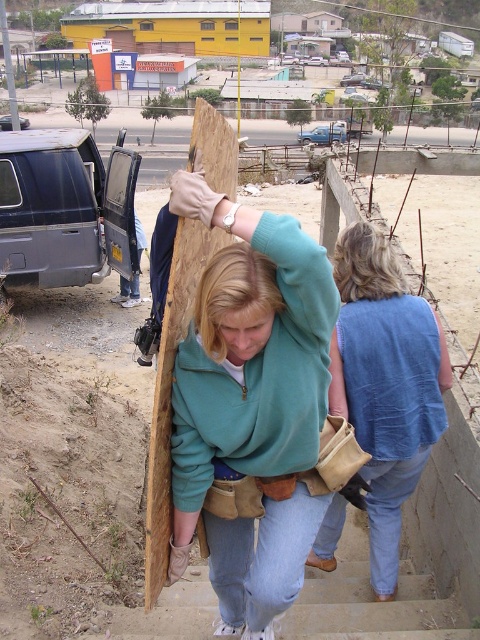
Can you confirm if teal fleece sweatshirt at center is positioned below wooden plank at center?

Yes, teal fleece sweatshirt at center is below wooden plank at center.

Between point (212, 435) and point (204, 115), which one is positioned in front?

Positioned in front is point (212, 435).

The image size is (480, 640). Find the location of `teal fleece sweatshirt at center`. teal fleece sweatshirt at center is located at coordinates (248, 355).

Based on the photo, who is positioned more to the right, blue knitted vest at upper right or wooden plank at center?

blue knitted vest at upper right is more to the right.

Does blue knitted vest at upper right lie in front of wooden plank at center?

No.

Is point (393, 400) in front of point (160, 435)?

That is False.

Find the location of a particular element. blue knitted vest at upper right is located at coordinates (385, 384).

Between teal fleece sweatshirt at center and blue knitted vest at upper right, which one is positioned lower?

teal fleece sweatshirt at center

Is teal fleece sweatshirt at center behind blue knitted vest at upper right?

No, teal fleece sweatshirt at center is closer to the viewer.

Image resolution: width=480 pixels, height=640 pixels. Describe the element at coordinates (248, 355) in the screenshot. I see `teal fleece sweatshirt at center` at that location.

Find the location of a particular element. teal fleece sweatshirt at center is located at coordinates (248, 355).